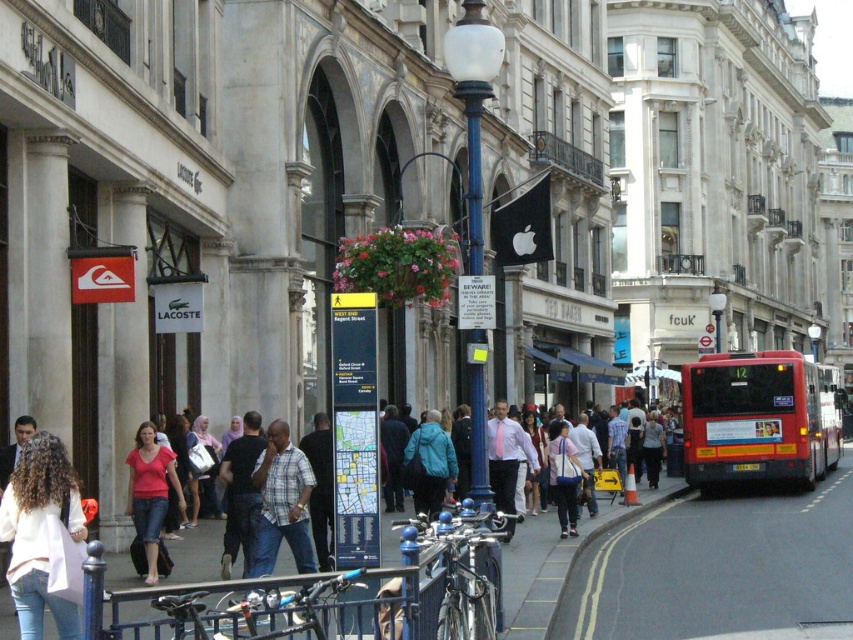
Question: Is blue metal pole at center thinner than red metallic bus at right?

Choices:
 (A) no
 (B) yes

Answer: (B)

Question: Among these points, which one is nearest to the camera?

Choices:
 (A) (691, 481)
 (B) (480, 362)
 (C) (474, 330)
 (D) (152, 531)

Answer: (B)

Question: Among these objects, which one is farthest from the camera?

Choices:
 (A) matte red shirt at center
 (B) red rubber bus at right
 (C) red metallic bus at right
 (D) blue painted metal pole at center

Answer: (C)

Question: Is the position of matte red shirt at center more distant than that of red metallic bus at right?

Choices:
 (A) yes
 (B) no

Answer: (B)

Question: Does concrete pavement at lower right lie behind plaid shirt at center?

Choices:
 (A) no
 (B) yes

Answer: (A)

Question: Which point is farther to the camera?

Choices:
 (A) (784, 385)
 (B) (431, 428)

Answer: (A)